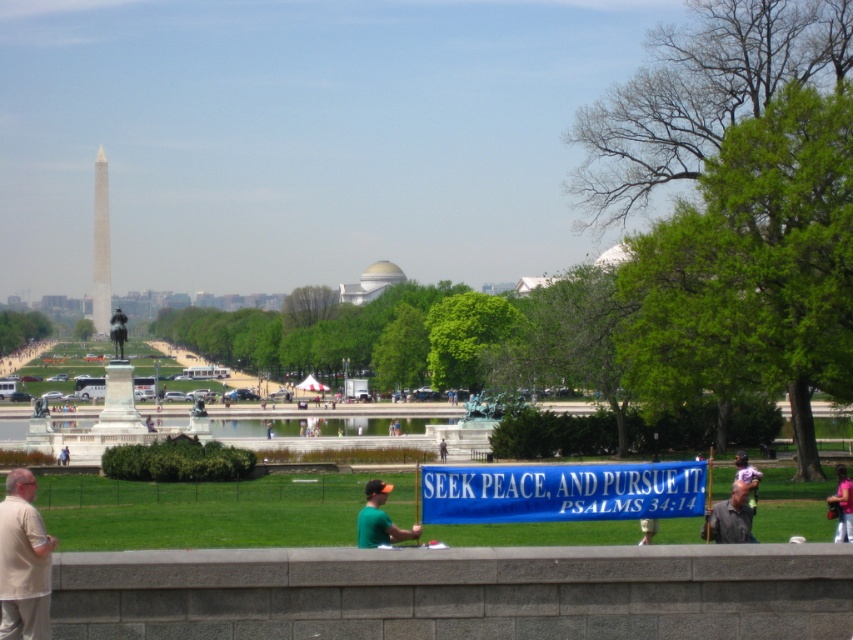
Question: Among these objects, which one is nearest to the camera?

Choices:
 (A) polished marble obelisk at center-left
 (B) light purple fabric at lower right

Answer: (B)

Question: Which point is farther to the camera?

Choices:
 (A) pink fabric shirt at lower right
 (B) beige cotton shirt at lower left

Answer: (A)

Question: Is beige cotton shirt at lower left above green fabric shirt at center?

Choices:
 (A) no
 (B) yes

Answer: (B)

Question: In this image, where is blue fabric banner at center located relative to gray fabric cap at center?

Choices:
 (A) left
 (B) right

Answer: (A)

Question: Which of the following is the farthest from the observer?

Choices:
 (A) polished marble obelisk at center-left
 (B) blue fabric banner at center
 (C) light purple fabric at lower right
 (D) pink fabric shirt at lower right

Answer: (A)

Question: Does gray fabric cap at center appear over pink fabric shirt at lower right?

Choices:
 (A) no
 (B) yes

Answer: (B)